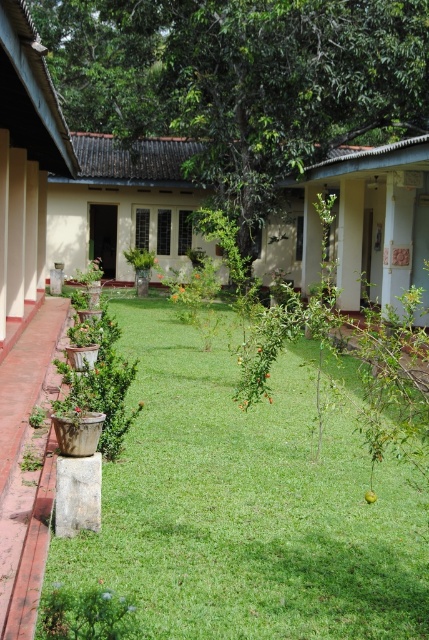
Question: Is green grass at center positioned in front of green leafy tree at center?

Choices:
 (A) yes
 (B) no

Answer: (A)

Question: Is green grass at center smaller than green leafy tree at center?

Choices:
 (A) no
 (B) yes

Answer: (B)

Question: Which of the following is the farthest from the observer?

Choices:
 (A) green grass at center
 (B) green leafy tree at center

Answer: (B)

Question: Is green grass at center to the right of green leafy tree at center from the viewer's perspective?

Choices:
 (A) no
 (B) yes

Answer: (B)